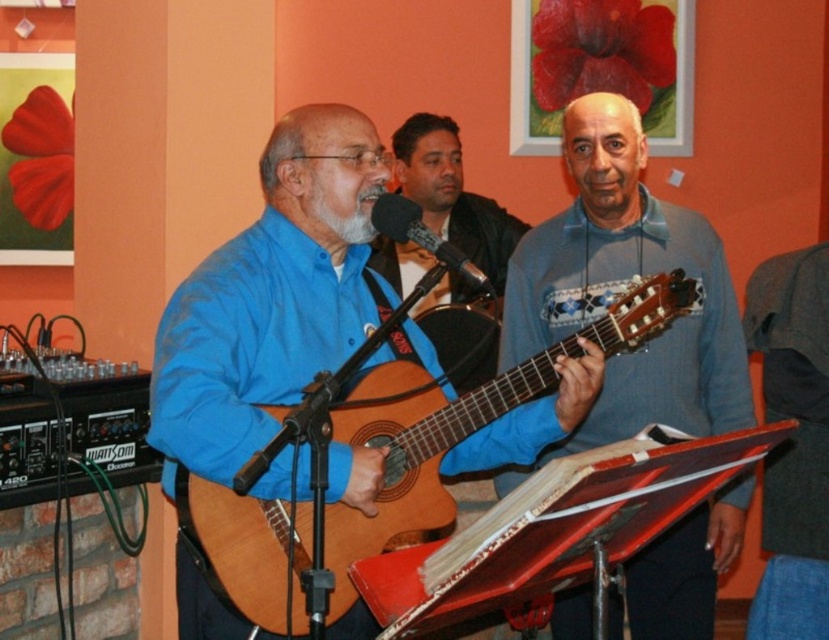
Question: Observing the image, what is the correct spatial positioning of gray cotton sweater at center in reference to wooden acoustic guitar at center?

Choices:
 (A) below
 (B) above

Answer: (A)

Question: Is wooden acoustic guitar at center above black matte microphone at center?

Choices:
 (A) no
 (B) yes

Answer: (A)

Question: Among these objects, which one is farthest from the camera?

Choices:
 (A) blue fabric shirt at center
 (B) black matte microphone at center
 (C) gray cotton sweater at center
 (D) wooden acoustic guitar at center

Answer: (A)

Question: Which object is farther from the camera taking this photo?

Choices:
 (A) black matte microphone at center
 (B) gray cotton sweater at center
 (C) wooden acoustic guitar at center
 (D) blue fabric shirt at center

Answer: (D)

Question: Which object is farther from the camera taking this photo?

Choices:
 (A) gray cotton sweater at center
 (B) wooden acoustic guitar at center
 (C) black matte microphone at center
 (D) blue fabric shirt at center

Answer: (D)

Question: Does gray cotton sweater at center have a greater width compared to black matte microphone at center?

Choices:
 (A) yes
 (B) no

Answer: (A)